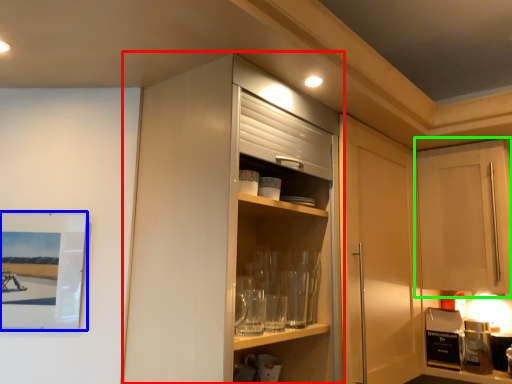
Question: Which object is the closest to the cabinetry (highlighted by a red box)? Choose among these: picture frame (highlighted by a blue box) or cabinetry (highlighted by a green box).

Choices:
 (A) picture frame
 (B) cabinetry

Answer: (A)